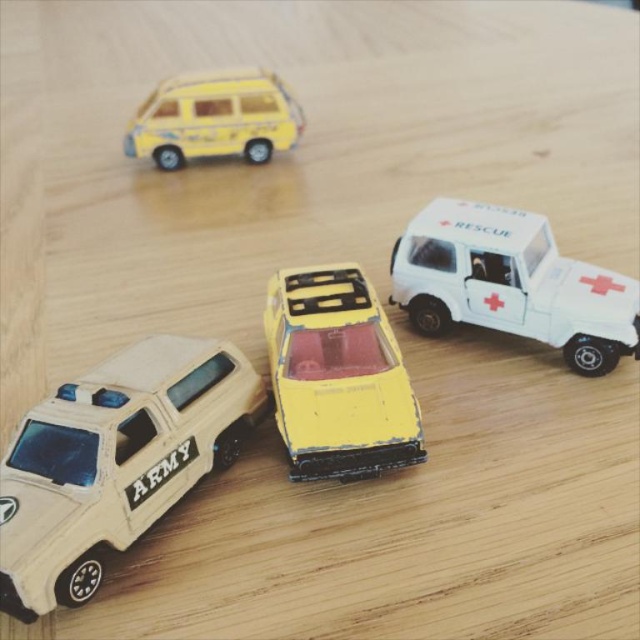
Question: Does white matte rescue car at upper right have a lesser width compared to yellow matte van at upper left?

Choices:
 (A) yes
 (B) no

Answer: (A)

Question: Can you confirm if white matte rescue car at upper right is positioned to the right of yellow matte car at center?

Choices:
 (A) no
 (B) yes

Answer: (B)

Question: Which point is farther to the camera?

Choices:
 (A) (180, 449)
 (B) (500, 273)
 (C) (292, 116)

Answer: (C)

Question: Can you confirm if yellow matte car at center is positioned to the left of yellow matte van at upper left?

Choices:
 (A) no
 (B) yes

Answer: (A)

Question: Which is nearer to the yellow matte van at upper left?

Choices:
 (A) yellow matte car at center
 (B) white matte rescue car at upper right

Answer: (B)

Question: Which object appears closest to the camera in this image?

Choices:
 (A) yellow matte car at center
 (B) tan matte/wooden army vehicle at lower left
 (C) yellow matte van at upper left
 (D) white matte rescue car at upper right

Answer: (B)